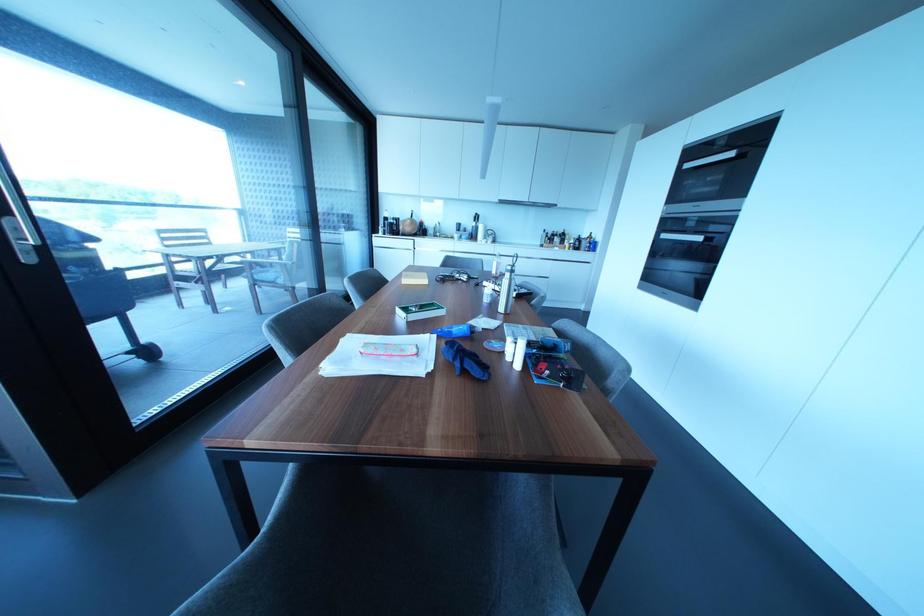
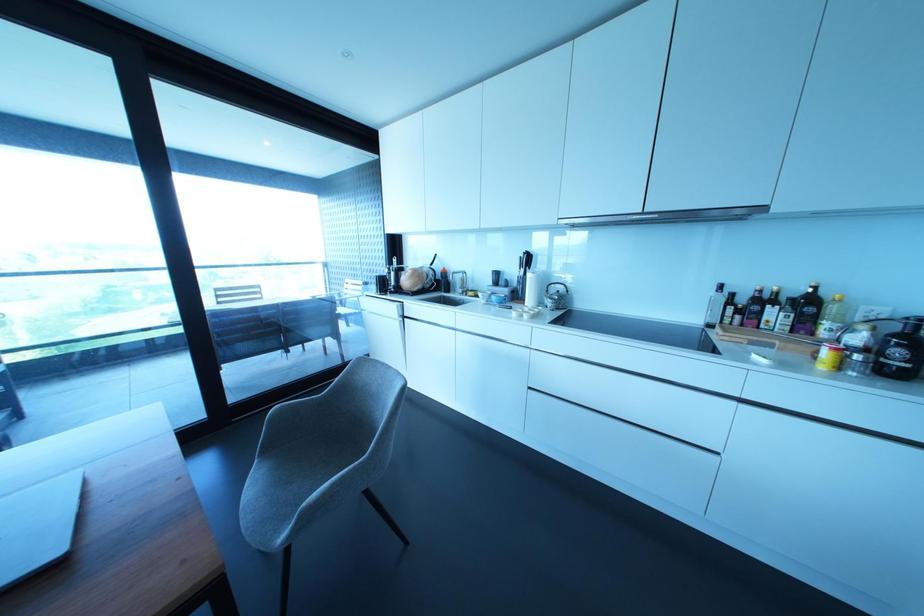
The point at (463, 236) is marked in the first image. Where is the corresponding point in the second image?

(492, 297)